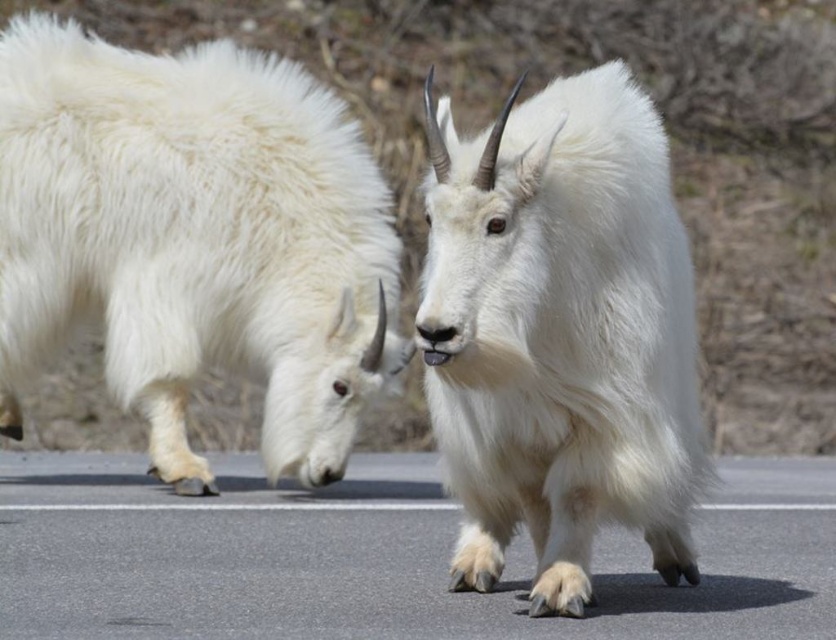
Question: Is white fluffy goat at left behind white fluffy goat at center?

Choices:
 (A) yes
 (B) no

Answer: (A)

Question: Does white fluffy goat at left appear on the right side of white fluffy goat at center?

Choices:
 (A) yes
 (B) no

Answer: (B)

Question: Can you confirm if white fluffy goat at left is positioned above white fluffy goat at center?

Choices:
 (A) no
 (B) yes

Answer: (B)